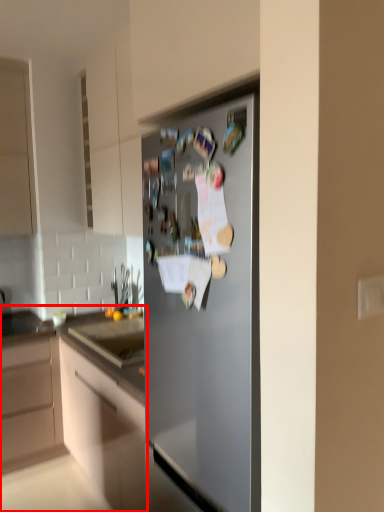
Question: Considering the relative positions of cabinetry (annotated by the red box) and refrigerator in the image provided, where is cabinetry (annotated by the red box) located with respect to the staircase?

Choices:
 (A) right
 (B) left

Answer: (B)